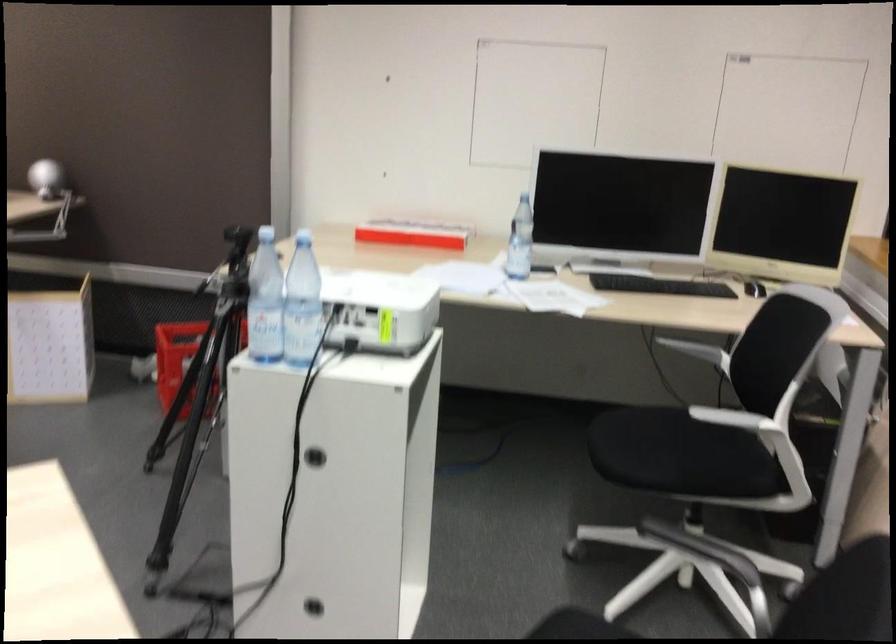
At what (x,y) coordinates should I click in order to perform the action: click on chair sitting surface. Please return your answer as a coordinate pair (x, y). The height and width of the screenshot is (644, 896). Looking at the image, I should click on pos(679,455).